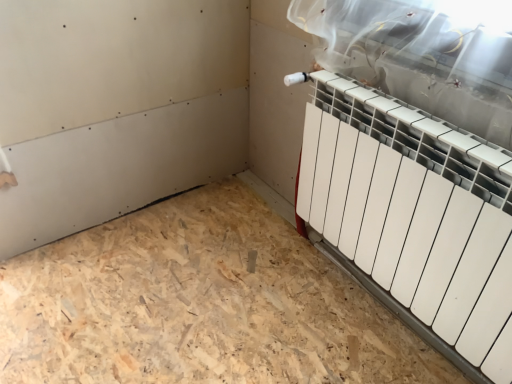
Where is `blank area beneath white matte radiator at upper right (from a real-world perspective)`? This screenshot has height=384, width=512. blank area beneath white matte radiator at upper right (from a real-world perspective) is located at coordinates (395, 314).